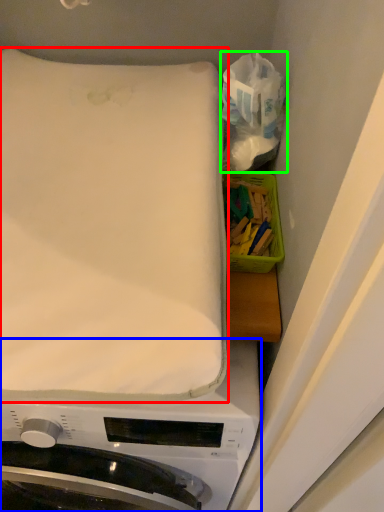
Question: Which object is positioned closest to mattress (highlighted by a red box)? Select from washing machine (highlighted by a blue box) and tissue (highlighted by a green box).

Choices:
 (A) washing machine
 (B) tissue

Answer: (B)